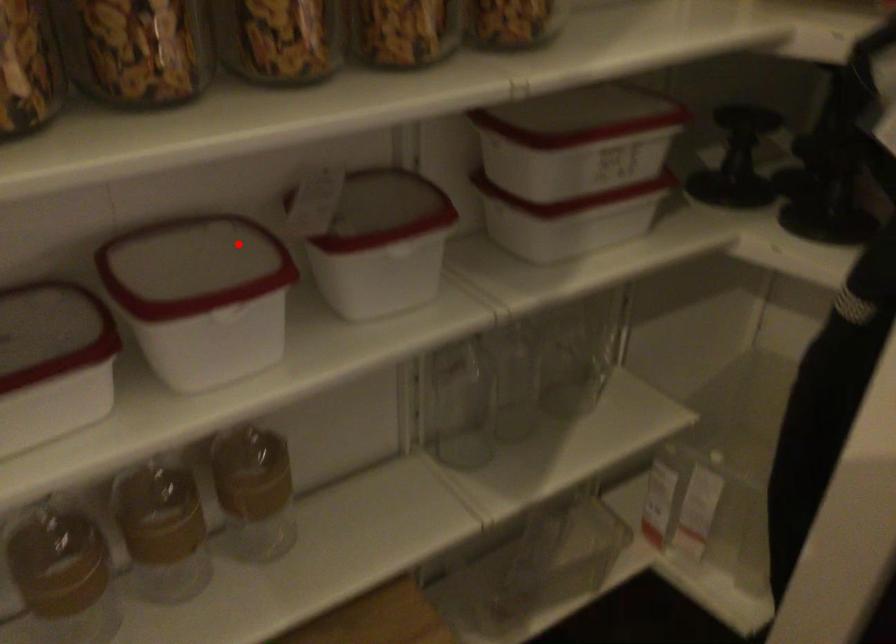
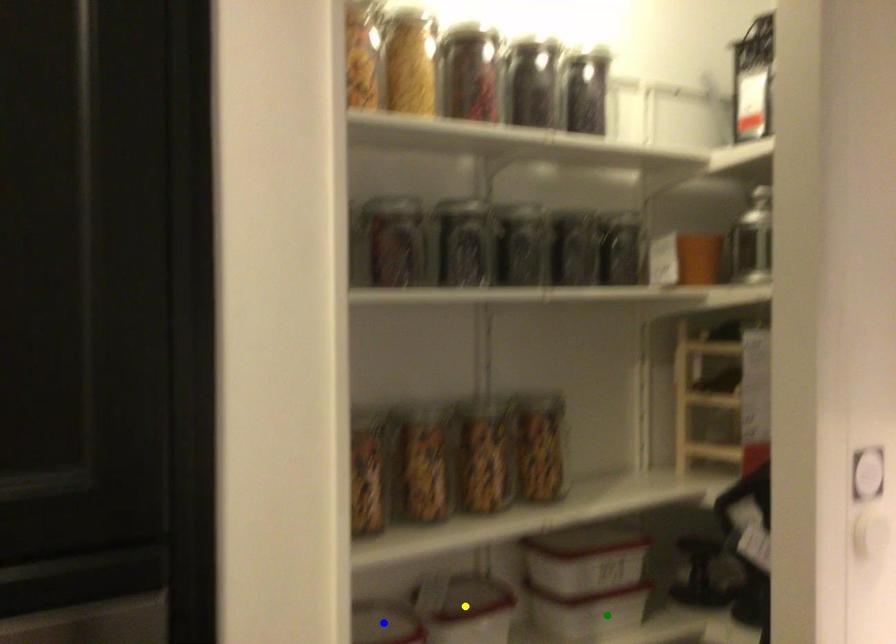
Question: I am providing you with two images of the same scene from different viewpoints. A red point is marked on the first image. You are given multiple points on the second image. In image 2, which mark is for the same physical point as the one in image 1?

Choices:
 (A) blue point
 (B) yellow point
 (C) green point

Answer: (A)